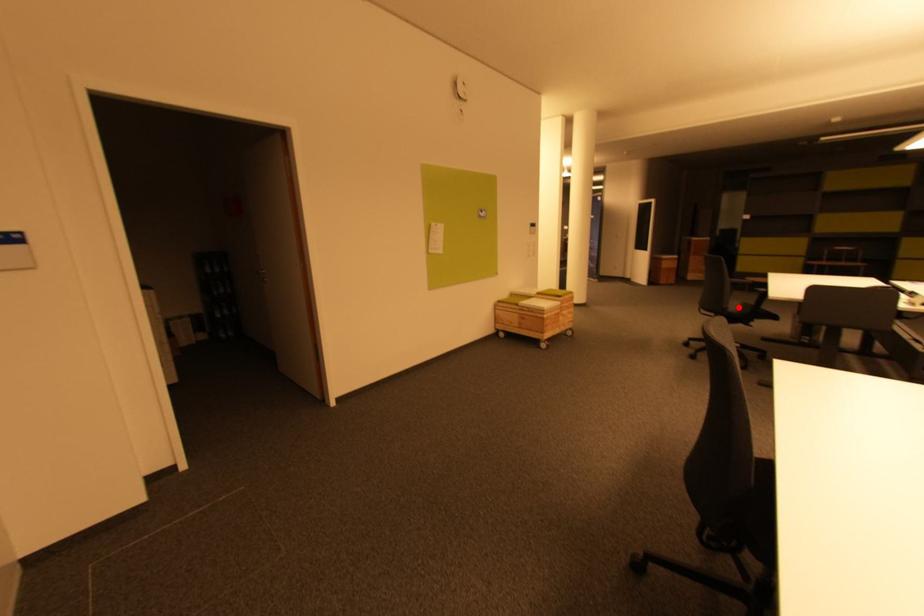
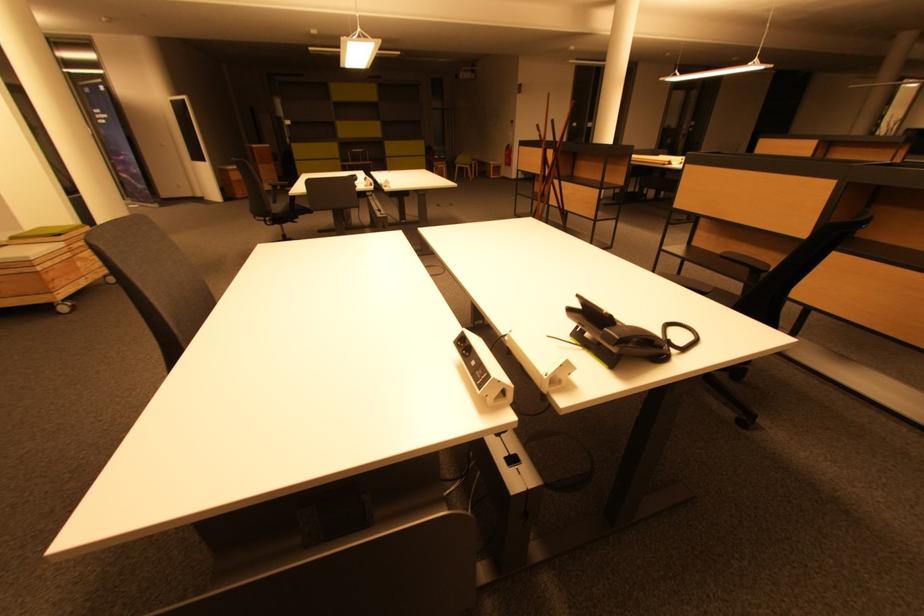
Question: I am providing you with two images of the same scene from different viewpoints. In image1, a red point is highlighted. Considering the same 3D point in image2, which of the following is correct?

Choices:
 (A) It is closer
 (B) It is farther

Answer: (A)